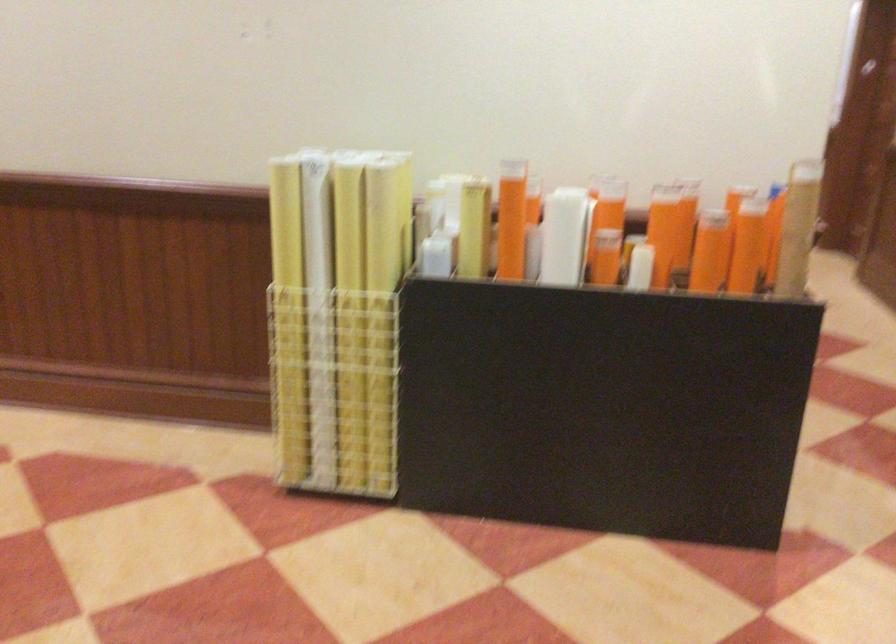
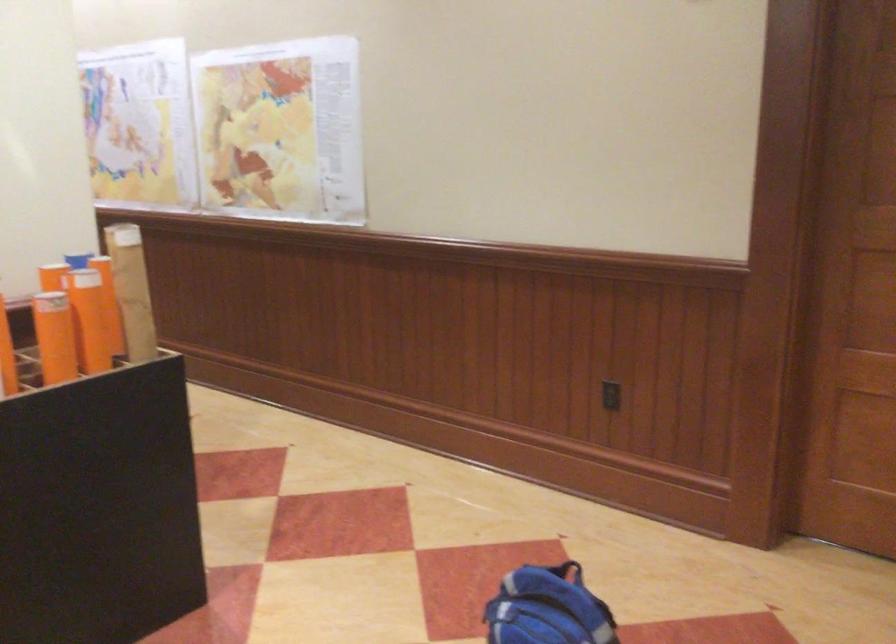
Locate, in the second image, the point that corresponds to point 736,254 in the first image.

(99, 330)